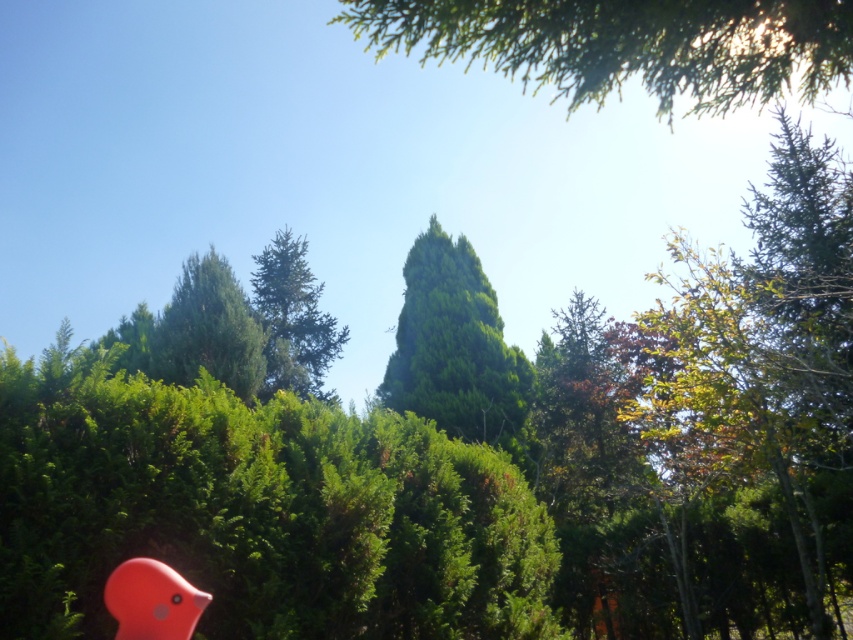
You are a bird flying over the green leafy tree at upper center and the green textured tree at upper left. Which tree would you land on first if you are flying straight towards them?

You would land on the green leafy tree at upper center first because it is closer to the viewer than the green textured tree at upper left.